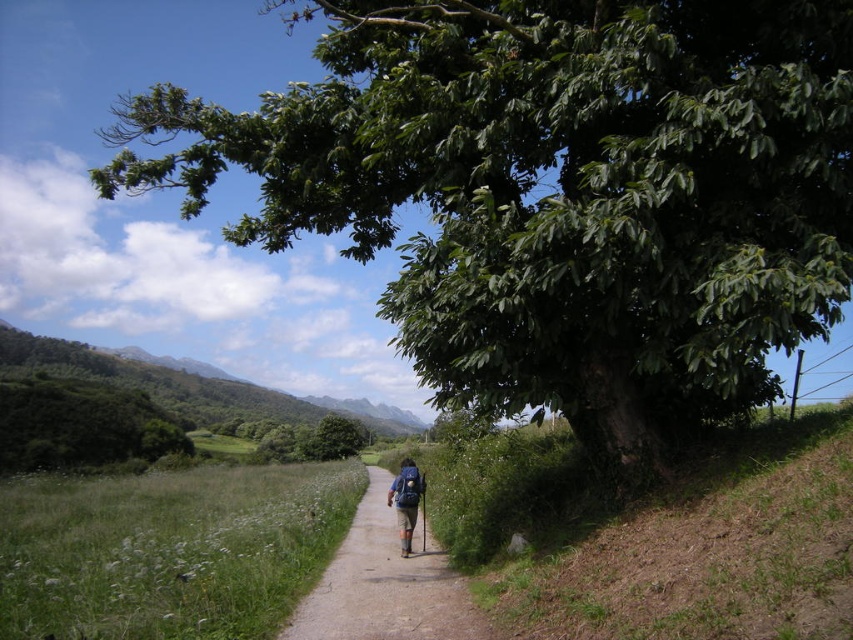
Between point (788, 212) and point (366, 588), which one is positioned behind?

The point (366, 588) is more distant.

Can you confirm if green leafy tree at upper right is positioned below brown dirt path at center?

No, green leafy tree at upper right is not below brown dirt path at center.

The width and height of the screenshot is (853, 640). What do you see at coordinates (556, 193) in the screenshot?
I see `green leafy tree at upper right` at bounding box center [556, 193].

Identify the location of green leafy tree at upper right. The image size is (853, 640). (556, 193).

The height and width of the screenshot is (640, 853). Describe the element at coordinates (556, 193) in the screenshot. I see `green leafy tree at upper right` at that location.

Who is more forward, (514,333) or (397,515)?

Point (514,333) is in front.

This screenshot has height=640, width=853. I want to click on green leafy tree at upper right, so click(x=556, y=193).

Consider the image. Between brown dirt path at center and blue fabric backpack at center, which one has less height?

→ blue fabric backpack at center is shorter.

Does brown dirt path at center have a greater height compared to blue fabric backpack at center?

Correct, brown dirt path at center is much taller as blue fabric backpack at center.

Between point (368, 593) and point (410, 460), which one is positioned in front?

Point (368, 593) is in front.

You are a GUI agent. You are given a task and a screenshot of the screen. Output one action in this format:
    pyautogui.click(x=<x>, y=<y>)
    Task: Click on the brown dirt path at center
    Image resolution: width=853 pixels, height=640 pixels.
    Given the screenshot: What is the action you would take?
    pyautogui.click(x=386, y=584)